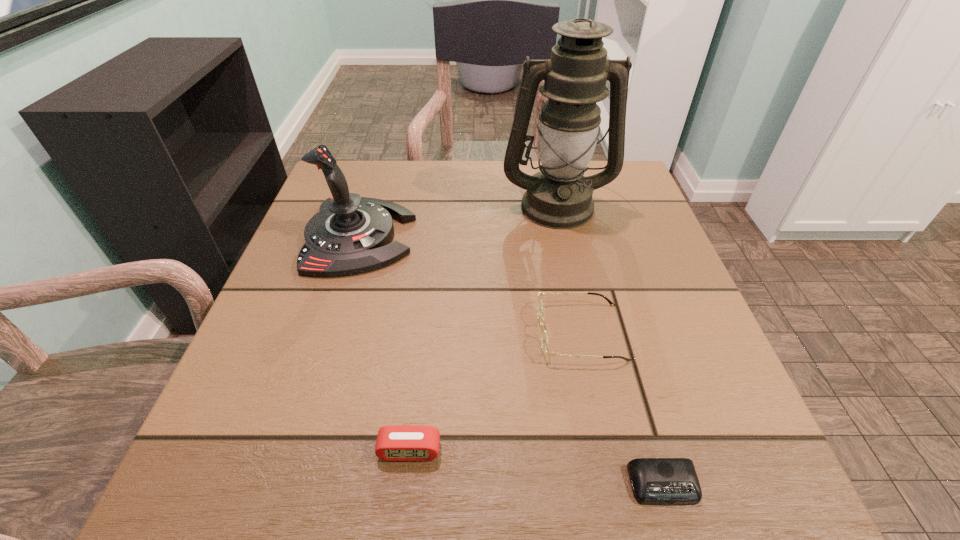
Where is `the tallest object`? This screenshot has width=960, height=540. the tallest object is located at coordinates (559, 196).

You are a GUI agent. You are given a task and a screenshot of the screen. Output one action in this format:
    pyautogui.click(x=<x>, y=<y>)
    Task: Click on the joystick
    This screenshot has width=960, height=540.
    Given the screenshot: What is the action you would take?
    pyautogui.click(x=350, y=234)

Locate an element on the screen. Image resolution: width=960 pixels, height=540 pixels. the fourth shortest object is located at coordinates (350, 234).

Locate an element on the screen. This screenshot has width=960, height=540. spectacles is located at coordinates point(544,340).

Find the location of `the left alarm clock`. the left alarm clock is located at coordinates (396, 442).

Identify the location of the farther alarm clock. (396, 442).

The image size is (960, 540). I want to click on the shortest object, so click(657, 481).

This screenshot has width=960, height=540. Find the location of `the shorter alarm clock`. the shorter alarm clock is located at coordinates (657, 481).

What are the coordinates of `vacant space located 0.370m on the left of the tallest object` in the screenshot? It's located at (343, 205).

Image resolution: width=960 pixels, height=540 pixels. Find the location of `free space located on the handle side of the joystick`. free space located on the handle side of the joystick is located at coordinates (540, 237).